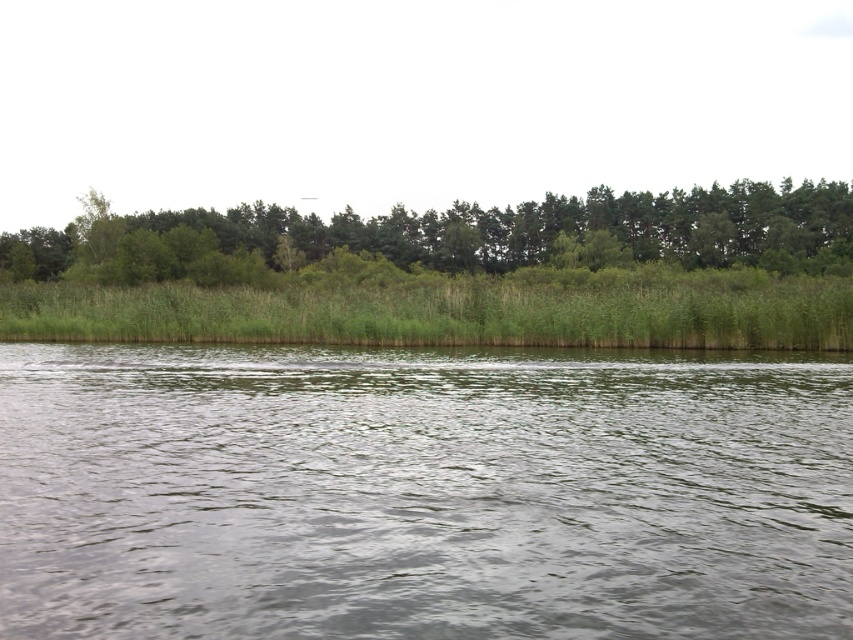
Question: Is green water at center thinner than green leafy trees at upper center?

Choices:
 (A) yes
 (B) no

Answer: (A)

Question: Can you confirm if green water at center is positioned to the right of green leafy trees at upper center?

Choices:
 (A) yes
 (B) no

Answer: (A)

Question: Which point is farther from the camera taking this photo?

Choices:
 (A) (469, 502)
 (B) (296, 266)

Answer: (B)

Question: Among these points, which one is farthest from the camera?

Choices:
 (A) (653, 515)
 (B) (254, 259)

Answer: (B)

Question: Can you confirm if green water at center is smaller than green leafy trees at upper center?

Choices:
 (A) yes
 (B) no

Answer: (A)